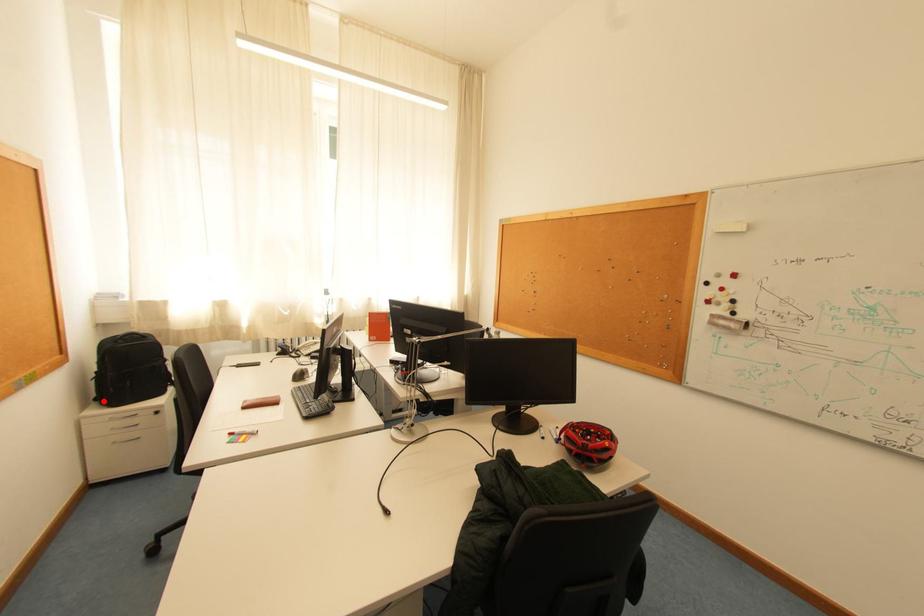
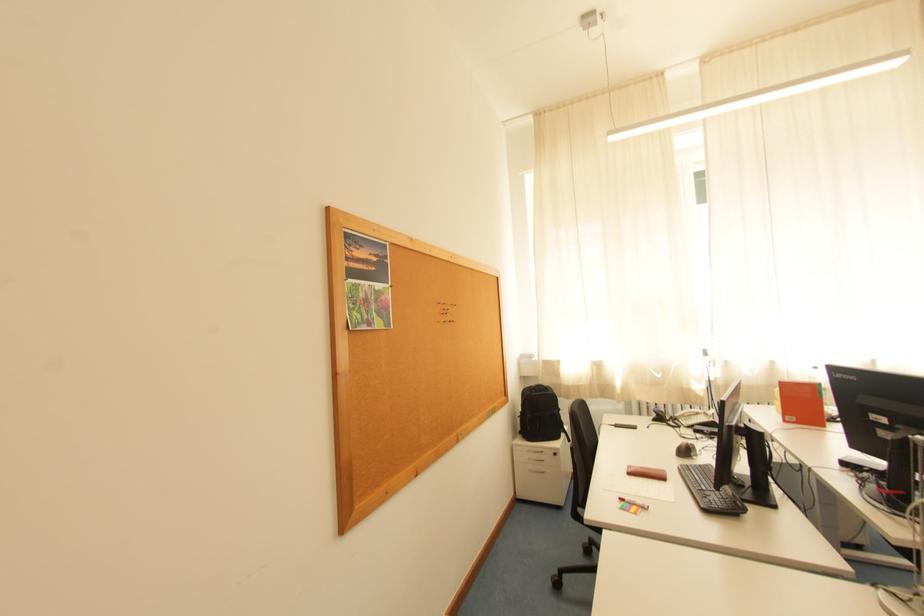
In the second image, find the point that corresponds to the highlighted location in the first image.

(528, 434)